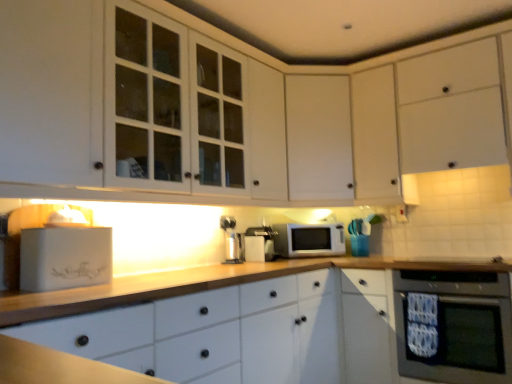
Question: From a real-world perspective, relative to satin silver coffee machine at center, the first coffee machine when ordered from right to left, is black glass oven at lower right vertically above or below?

Choices:
 (A) above
 (B) below

Answer: (B)

Question: Is black glass oven at lower right taller or shorter than satin silver coffee machine at center, the first coffee machine when ordered from right to left?

Choices:
 (A) short
 (B) tall

Answer: (B)

Question: Considering the real-world distances, which object is farthest from the white matte microwave at center?

Choices:
 (A) white matte cabinet at center, marked as the 3th cabinetry in a right-to-left arrangement
 (B) white glossy cabinet at upper left, which is counted as the first cabinetry, starting from the left
 (C) white matte bread bin at left
 (D) white matte cabinet at upper right, the fourth cabinetry in the left-to-right sequence
 (E) satin silver coffee machine at center, which is the second coffee machine in left-to-right order

Answer: (C)

Question: Which is farther from the white matte cabinet at center, marked as the 3th cabinetry in a right-to-left arrangement?

Choices:
 (A) white matte cabinet at upper right, the fourth cabinetry in the left-to-right sequence
 (B) satin silver coffee machine at center, arranged as the 2th coffee machine when viewed from the right
 (C) white plastic electric outlet at upper right
 (D) satin silver coffee machine at center, which is the second coffee machine in left-to-right order
 (E) white glossy cabinet at upper left, which is counted as the first cabinetry, starting from the left

Answer: (C)